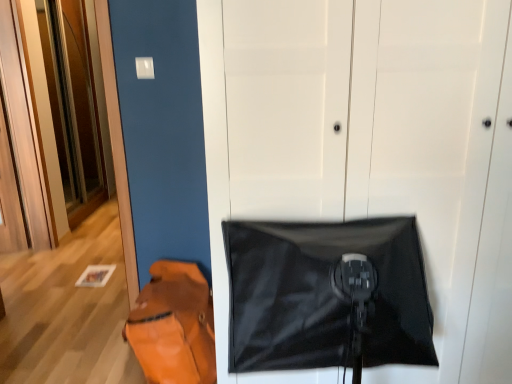
This screenshot has height=384, width=512. What do you see at coordinates (324, 295) in the screenshot?
I see `black matte blanket at center` at bounding box center [324, 295].

Measure the distance between point (186,371) and camera.

The distance of point (186,371) from camera is 1.87 meters.

At what (x,y) coordinates should I click in order to perform the action: click on black matte blanket at center. Please return your answer as a coordinate pair (x, y). Looking at the image, I should click on (324, 295).

Between wooden at left, arranged as the 1th door when viewed from the back, and black matte blanket at center, which one has larger width?

With larger width is black matte blanket at center.

Is point (58, 154) closer or farther from the camera than point (380, 253)?

Clearly, point (58, 154) is more distant from the camera than point (380, 253).

Is wooden at left, arranged as the 1th door when viewed from the back, not within black matte blanket at center?

Absolutely, wooden at left, arranged as the 1th door when viewed from the back, is external to black matte blanket at center.

Visually, is wooden at left, which is counted as the 1th door, starting from the left, positioned to the left or to the right of black matte blanket at center?

wooden at left, which is counted as the 1th door, starting from the left, is positioned on black matte blanket at center's left side.

From a real-world perspective, which object stands above the other?

In real-world perspective, black matte blanket at center is above.

The height and width of the screenshot is (384, 512). I want to click on messenger bag on the left of black matte blanket at center, so click(174, 326).

Would you say black matte blanket at center contains leather-like orange messenger bag at lower left?

No, leather-like orange messenger bag at lower left is located outside of black matte blanket at center.

Is black matte blanket at center facing towards leather-like orange messenger bag at lower left?

No.

Considering the relative sizes of leather-like orange messenger bag at lower left and black matte door at center, which appears as the second door when viewed from the left, in the image provided, is leather-like orange messenger bag at lower left shorter than black matte door at center, which appears as the second door when viewed from the left,?

Correct, leather-like orange messenger bag at lower left is not as tall as black matte door at center, which appears as the second door when viewed from the left.

How different are the orientations of leather-like orange messenger bag at lower left and black matte door at center, marked as the 1th door in a right-to-left arrangement, in degrees?

leather-like orange messenger bag at lower left and black matte door at center, marked as the 1th door in a right-to-left arrangement, are facing 0.247 degrees away from each other.

From the image's perspective, is leather-like orange messenger bag at lower left above or below black matte door at center, marked as the 1th door in a right-to-left arrangement?

Clearly, from the image's perspective, leather-like orange messenger bag at lower left is below black matte door at center, marked as the 1th door in a right-to-left arrangement.

In terms of width, does leather-like orange messenger bag at lower left look wider or thinner when compared to black matte door at center, marked as the 1th door in a right-to-left arrangement?

In the image, leather-like orange messenger bag at lower left appears to be more narrow than black matte door at center, marked as the 1th door in a right-to-left arrangement.

From a real-world perspective, is black matte door at center, marked as the 1th door in a right-to-left arrangement, physically located above or below black matte blanket at center?

black matte door at center, marked as the 1th door in a right-to-left arrangement, is situated higher than black matte blanket at center in the real world.

The width and height of the screenshot is (512, 384). I want to click on the 1st door above the black matte blanket at center (from the image's perspective), so click(388, 145).

Who is smaller, black matte door at center, which appears as the second door when viewed from the left, or black matte blanket at center?

With smaller size is black matte blanket at center.

Is point (57, 83) closer to camera compared to point (349, 155)?

No, it is not.

From a real-world perspective, is wooden at left, the second door in the front-to-back sequence, physically located above or below black matte door at center, positioned as the 2th door in back-to-front order?

In terms of real-world spatial position, wooden at left, the second door in the front-to-back sequence, is above black matte door at center, positioned as the 2th door in back-to-front order.

Based on the photo, does wooden at left, acting as the 2th door starting from the right, have a greater width compared to black matte door at center, marked as the 1th door in a right-to-left arrangement?

Incorrect, the width of wooden at left, acting as the 2th door starting from the right, does not surpass that of black matte door at center, marked as the 1th door in a right-to-left arrangement.

Is black matte door at center, positioned as the 2th door in back-to-front order, at the back of wooden at left, acting as the 2th door starting from the right?

No, wooden at left, acting as the 2th door starting from the right,'s orientation is not away from black matte door at center, positioned as the 2th door in back-to-front order.

Considering the sizes of objects black matte door at center, marked as the 1th door in a right-to-left arrangement, and leather-like orange messenger bag at lower left in the image provided, who is thinner, black matte door at center, marked as the 1th door in a right-to-left arrangement, or leather-like orange messenger bag at lower left?

leather-like orange messenger bag at lower left.

Is black matte door at center, which is counted as the 1th door, starting from the front, not close to leather-like orange messenger bag at lower left?

Actually, black matte door at center, which is counted as the 1th door, starting from the front, and leather-like orange messenger bag at lower left are a little close together.

At what (x,y) coordinates should I click in order to perform the action: click on door to the right of leather-like orange messenger bag at lower left. Please return your answer as a coordinate pair (x, y). Looking at the image, I should click on tap(388, 145).

What are the coordinates of `door that is the 1st one above the black matte blanket at center (from a real-world perspective)` in the screenshot? It's located at (388, 145).

Is black matte blanket at center not close to black matte door at center, marked as the 1th door in a right-to-left arrangement?

They are positioned close to each other.

Does black matte blanket at center turn towards black matte door at center, positioned as the 2th door in back-to-front order?

No, black matte blanket at center is not aimed at black matte door at center, positioned as the 2th door in back-to-front order.

Where is `blanket directly beneath the wooden at left, the second door in the front-to-back sequence (from a real-world perspective)`? Image resolution: width=512 pixels, height=384 pixels. blanket directly beneath the wooden at left, the second door in the front-to-back sequence (from a real-world perspective) is located at coordinates pos(324,295).

Where is `messenger bag behind the black matte blanket at center`? This screenshot has height=384, width=512. messenger bag behind the black matte blanket at center is located at coordinates (174, 326).

Considering their positions, is leather-like orange messenger bag at lower left positioned closer to wooden at left, arranged as the 1th door when viewed from the back, than black matte blanket at center?

Based on the image, leather-like orange messenger bag at lower left appears to be nearer to wooden at left, arranged as the 1th door when viewed from the back.

Which object lies further to the anchor point leather-like orange messenger bag at lower left, black matte door at center, which appears as the second door when viewed from the left, or wooden at left, which is counted as the 1th door, starting from the left?

wooden at left, which is counted as the 1th door, starting from the left, lies further to leather-like orange messenger bag at lower left than the other object.

From the image, which object appears to be farther from leather-like orange messenger bag at lower left, black matte blanket at center or black matte door at center, marked as the 1th door in a right-to-left arrangement?

The object further to leather-like orange messenger bag at lower left is black matte door at center, marked as the 1th door in a right-to-left arrangement.

Looking at the image, which one is located further to black matte door at center, which appears as the second door when viewed from the left, wooden at left, arranged as the 1th door when viewed from the back, or leather-like orange messenger bag at lower left?

wooden at left, arranged as the 1th door when viewed from the back.

Considering their positions, is wooden at left, acting as the 2th door starting from the right, positioned closer to black matte door at center, marked as the 1th door in a right-to-left arrangement, than black matte blanket at center?

black matte blanket at center lies closer to black matte door at center, marked as the 1th door in a right-to-left arrangement, than the other object.

Estimate the real-world distances between objects in this image. Which object is closer to black matte door at center, which appears as the second door when viewed from the left, leather-like orange messenger bag at lower left or black matte blanket at center?

black matte blanket at center is closer to black matte door at center, which appears as the second door when viewed from the left.

From the image, which object appears to be nearer to black matte blanket at center, leather-like orange messenger bag at lower left or wooden at left, arranged as the 1th door when viewed from the back?

The object closer to black matte blanket at center is leather-like orange messenger bag at lower left.

From the image, which object appears to be farther from black matte blanket at center, black matte door at center, which is counted as the 1th door, starting from the front, or leather-like orange messenger bag at lower left?

Among the two, leather-like orange messenger bag at lower left is located further to black matte blanket at center.

You are a GUI agent. You are given a task and a screenshot of the screen. Output one action in this format:
    pyautogui.click(x=<x>, y=<y>)
    Task: Click on the messenger bag between wooden at left, arranged as the 1th door when viewed from the back, and black matte door at center, marked as the 1th door in a right-to-left arrangement, from left to right
    
    Given the screenshot: What is the action you would take?
    coord(174,326)

Image resolution: width=512 pixels, height=384 pixels. I want to click on messenger bag between black matte blanket at center and wooden at left, acting as the 2th door starting from the right, in the front-back direction, so click(x=174, y=326).

Locate an element on the screen. door positioned between black matte blanket at center and leather-like orange messenger bag at lower left from near to far is located at coordinates (388, 145).

Locate an element on the screen. This screenshot has width=512, height=384. door between black matte blanket at center and wooden at left, acting as the 2th door starting from the right, in the front-back direction is located at coordinates (388, 145).